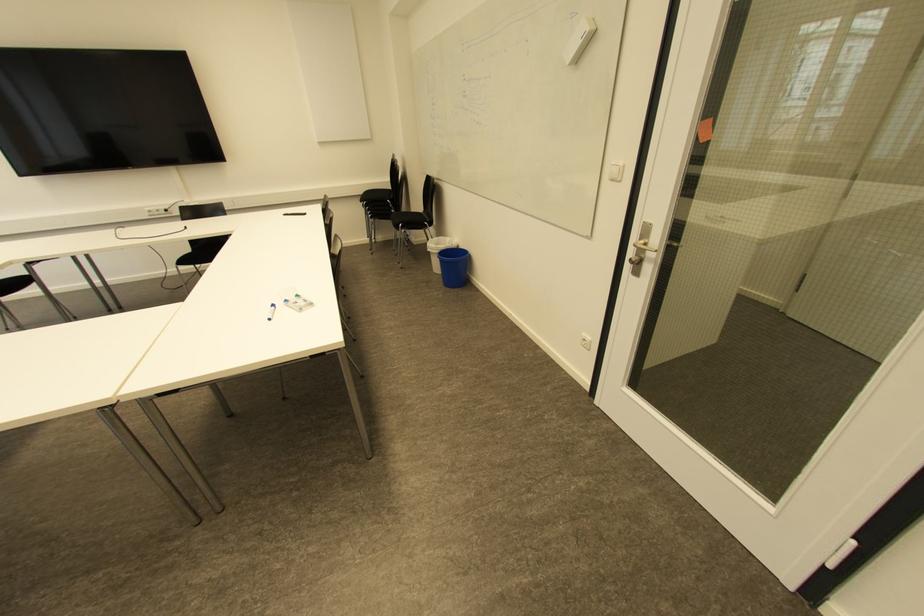
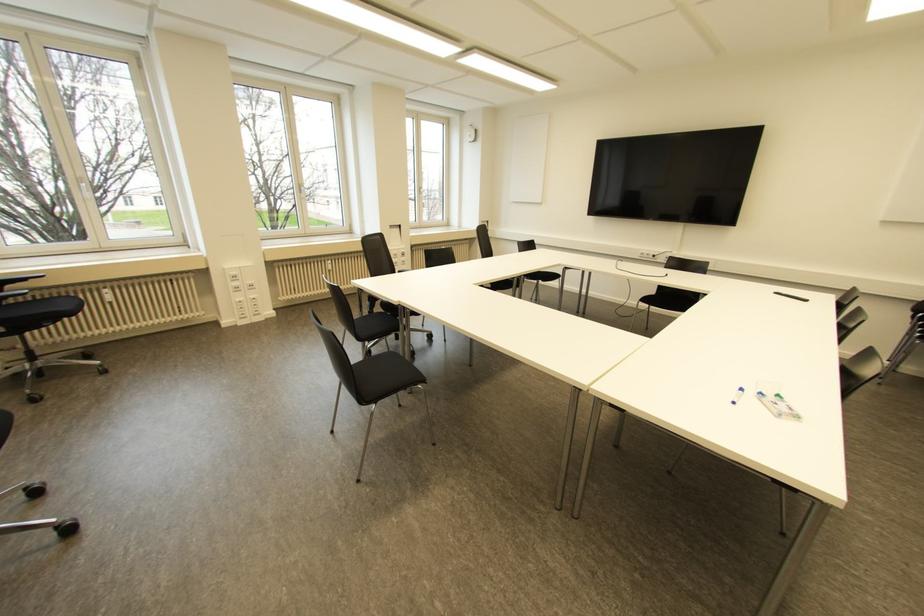
Question: How did the camera likely rotate?

Choices:
 (A) Left
 (B) Right
 (C) Up
 (D) Down

Answer: (A)